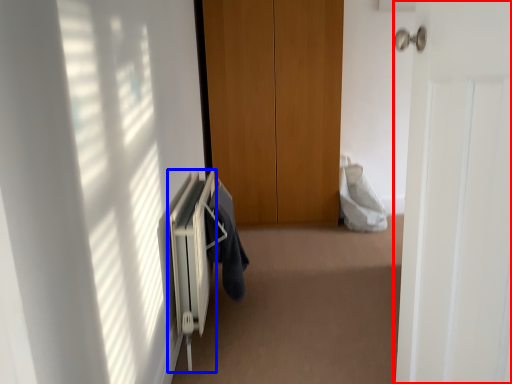
Question: Which object is closer to the camera taking this photo, door (highlighted by a red box) or radiator (highlighted by a blue box)?

Choices:
 (A) door
 (B) radiator

Answer: (A)